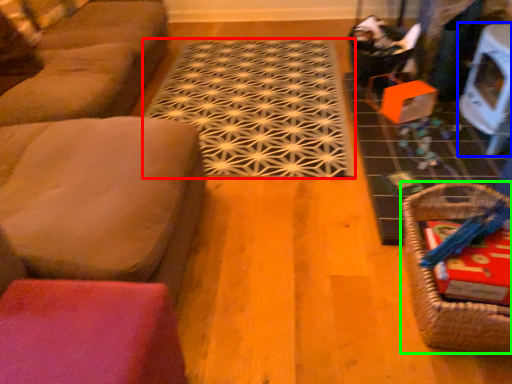
Question: Which object is the farthest from doormat (highlighted by a red box)? Choose among these: table (highlighted by a blue box) or basket (highlighted by a green box).

Choices:
 (A) table
 (B) basket

Answer: (B)